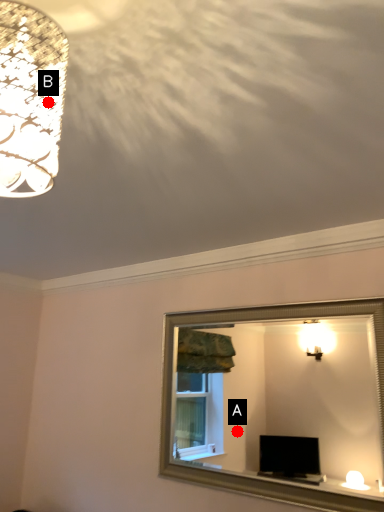
Question: Two points are circled on the image, labeled by A and B beside each circle. Among these points, which one is farthest from the camera?

Choices:
 (A) A is further
 (B) B is further

Answer: (A)